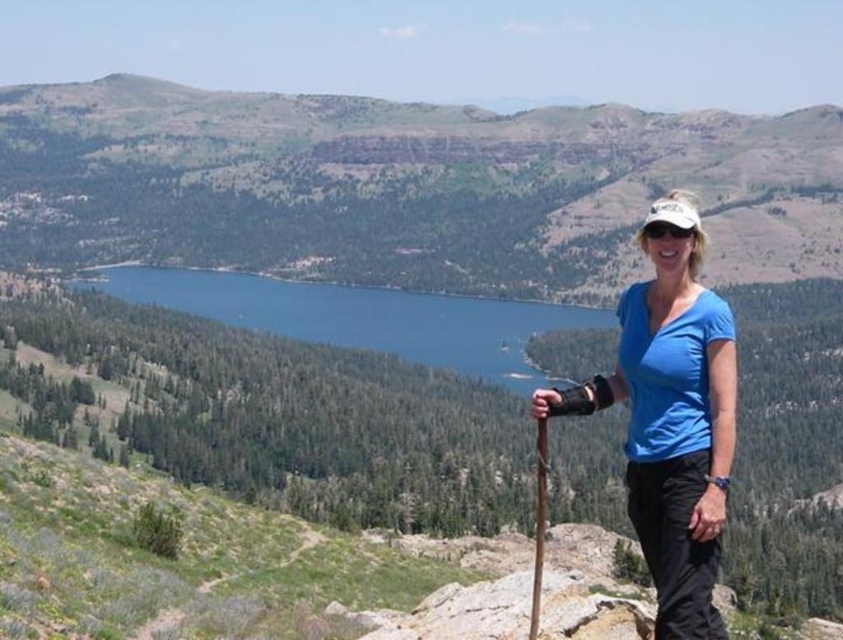
You are a hiker standing at point (302, 292) and want to reach the viewpoint at point (670, 202). Is the viewpoint in front of you or behind you?

The viewpoint at point (670, 202) is in front of you because it is located in front of point (302, 292) where you are standing.

You are a photographer planning to take a wide shot of the blue fabric shirt at right and the blue glassy lake at center. Which object appears wider in the photo?

The blue glassy lake at center appears wider in the photo because the blue fabric shirt at right has a lesser width compared to it.

You are a drone operator planning to fly a drone from point A to point B in the image. Point A is at coordinates point (31, 116) and point B is at coordinates point (704, 476). Considering the hiker is standing on a rocky outcrop on the right side of the frame, which point is closer to the hiker?

Point (704, 476) is closer to the hiker because it is further away from the viewer compared to point (31, 116), which is closer to the viewer. Since the hiker is on the right side of the frame, the point that is further away from the viewer and positioned towards the right would be nearer to the hiker.